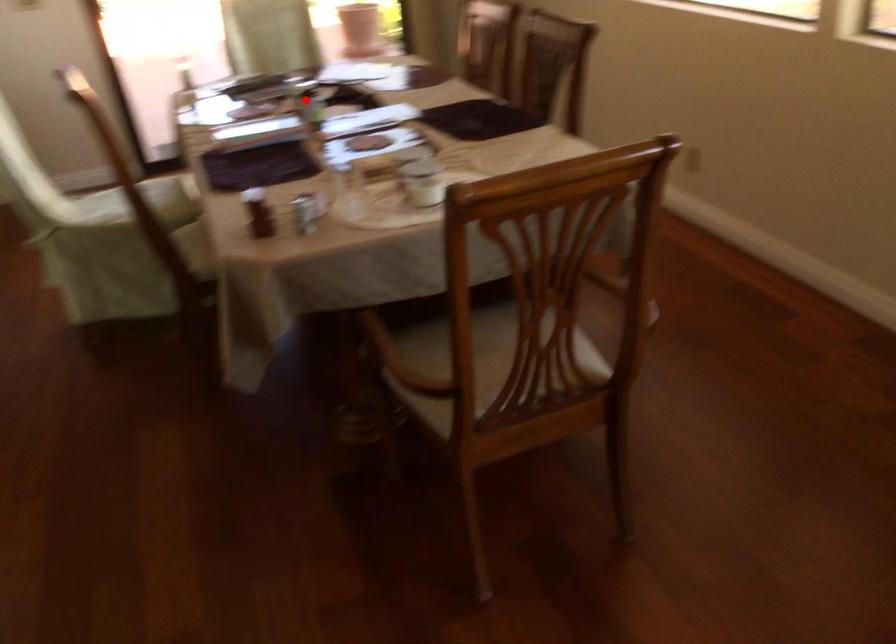
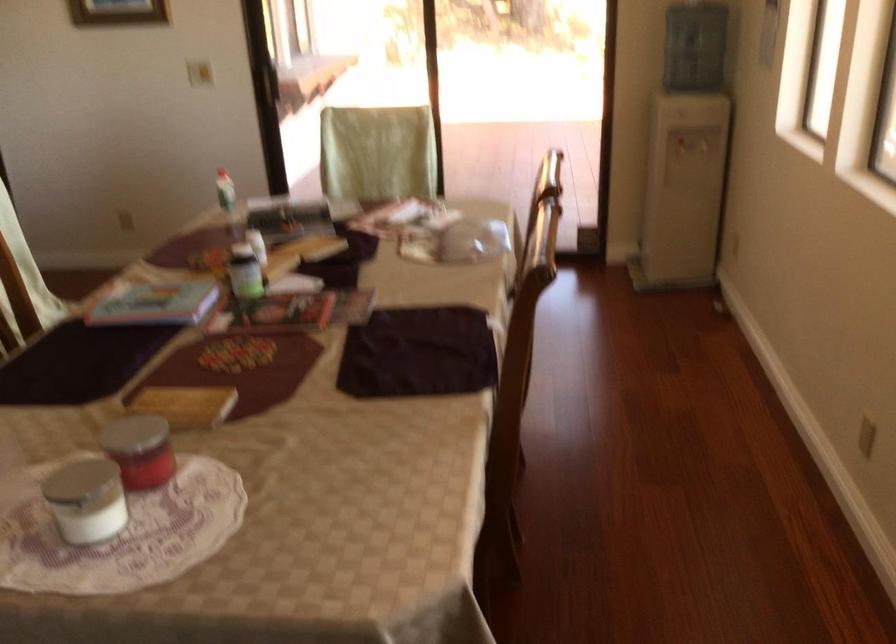
Where in the second image is the point corresponding to the highlighted location from the first image?

(245, 272)